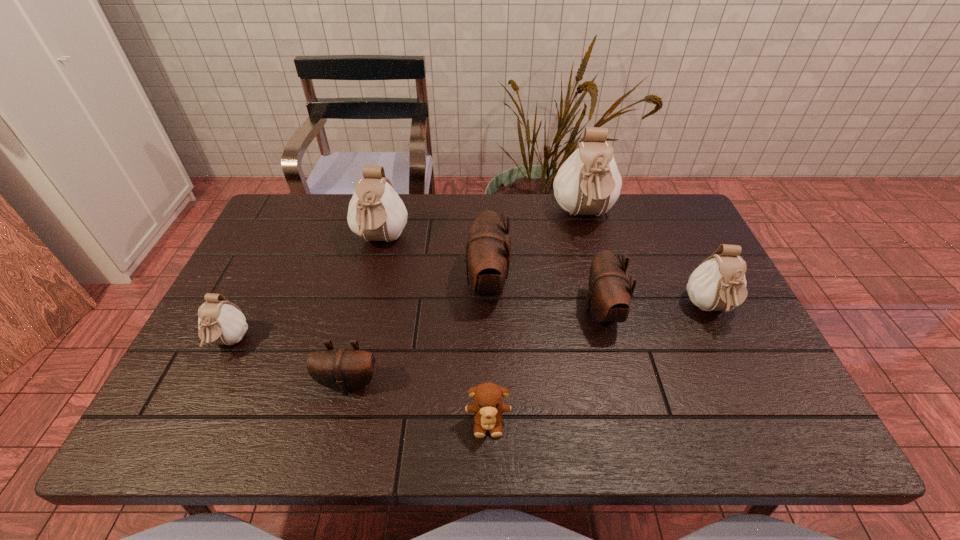
This screenshot has width=960, height=540. What are the coordinates of `the smallest brown pouch` in the screenshot? It's located at (343, 369).

You are a GUI agent. You are given a task and a screenshot of the screen. Output one action in this format:
    pyautogui.click(x=<x>, y=<y>)
    Task: Click on the second nearest object
    Image resolution: width=960 pixels, height=540 pixels.
    Given the screenshot: What is the action you would take?
    pyautogui.click(x=343, y=369)

Identify the location of brown teddy bear. The width and height of the screenshot is (960, 540). (488, 406).

Find the location of a particular element. the nearest object is located at coordinates (488, 406).

This screenshot has width=960, height=540. I want to click on blank space located on the front-facing side of the second white pouch from right to left, so click(609, 309).

This screenshot has width=960, height=540. What are the coordinates of `free space located 0.080m on the front-facing side of the second white pouch from left to right` in the screenshot? It's located at (370, 285).

Locate an element on the screen. Image resolution: width=960 pixels, height=540 pixels. free space located with the flap open on the second brown pouch from right to left is located at coordinates (336, 283).

Locate an element on the screen. The height and width of the screenshot is (540, 960). blank space located with the flap open on the second brown pouch from right to left is located at coordinates (424, 283).

At what (x,y) coordinates should I click in order to perform the action: click on blank space located with the flap open on the second brown pouch from right to left. Please return your answer as a coordinate pair (x, y). The width and height of the screenshot is (960, 540). Looking at the image, I should click on (318, 283).

This screenshot has height=540, width=960. In order to click on vacant space situated on the front-facing side of the rightmost white pouch in this screenshot , I will do `click(744, 381)`.